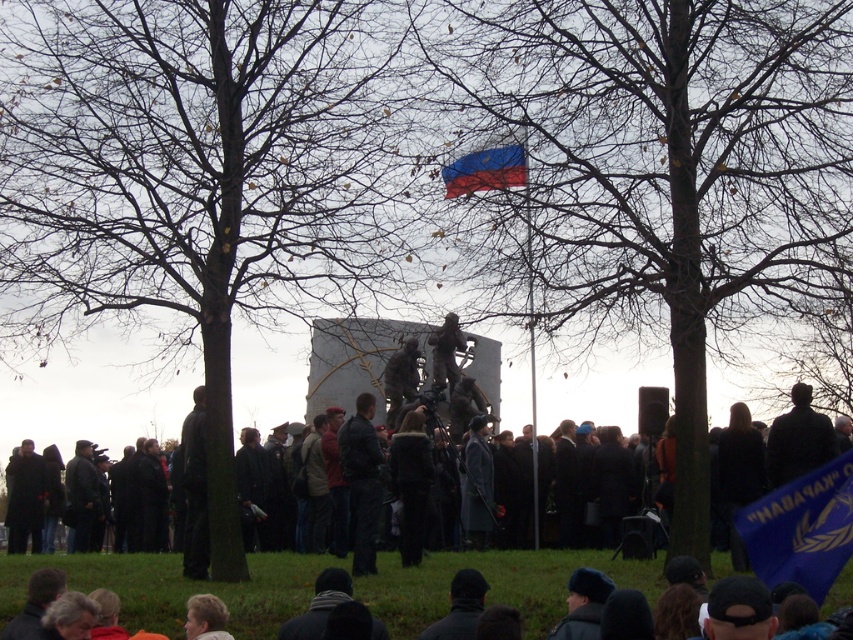
You are a photographer standing at the edge of the crowd. You want to take a photo that includes both the dark gray jacket at center and the red fabric flag at center. The camera you are using has a maximum zoom range that can capture objects up to 25 meters away. Will you be able to capture both subjects in a single frame without moving closer?

The distance between the dark gray jacket at center and the red fabric flag at center is 27.39 meters. Since the camera can only capture up to 25 meters, you won cannot capture both subjects in a single frame without moving closer.

You are a photographer positioned at the center of the image. You want to capture a photo that includes both the monument in the background and the blue fabric flag at lower right. Based on their positions, will the flag be visible in the frame if you focus on the monument?

The blue fabric flag at lower right is positioned at point (802,529), which is within the lower right area of the image. Since photographers typically frame shots to include elements from different areas, focusing on the monument in the background while positioning the camera to include the lower right corner should allow the flag to be visible in the frame.